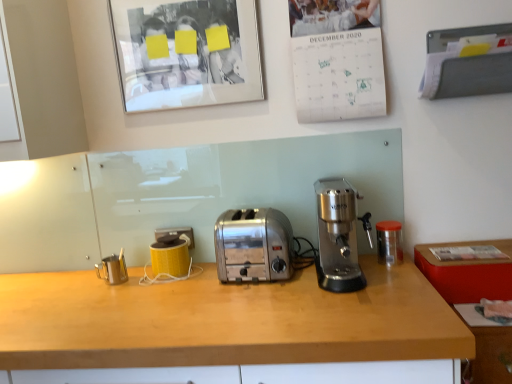
Where is `unoccupied region to the right of satin silver coffee maker at center`? unoccupied region to the right of satin silver coffee maker at center is located at coordinates (387, 263).